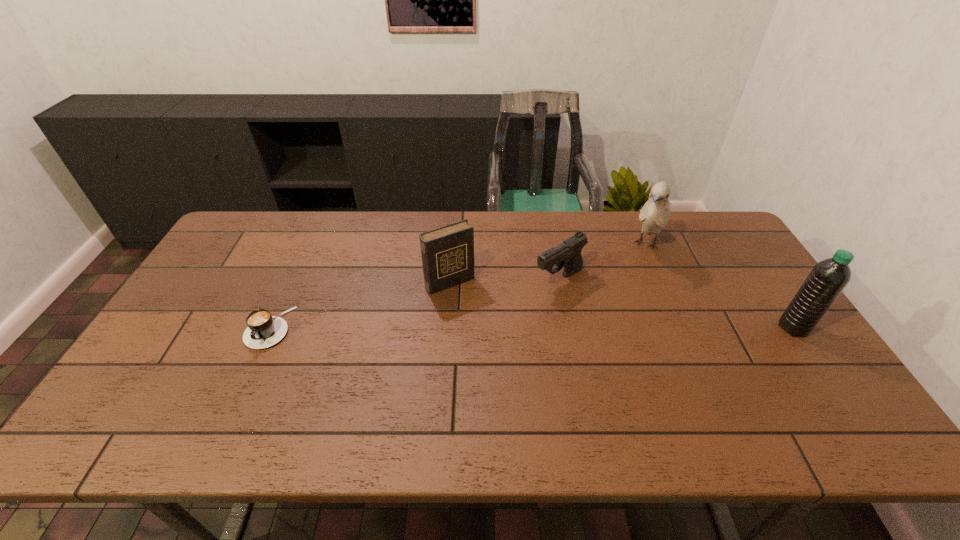
In the image, there is a desktop. Find the location of `vacant area at the far edge`. vacant area at the far edge is located at coordinates (446, 214).

This screenshot has width=960, height=540. Find the location of `free space at the near edge of the desktop`. free space at the near edge of the desktop is located at coordinates (396, 388).

The height and width of the screenshot is (540, 960). In the image, there is a desktop. Find the location of `vacant space at the left edge`. vacant space at the left edge is located at coordinates pyautogui.click(x=220, y=294).

Locate an element on the screen. This screenshot has height=540, width=960. vacant space at the right edge of the desktop is located at coordinates (711, 274).

In the image, there is a desktop. Identify the location of vacant space at the near left corner. This screenshot has height=540, width=960. (137, 399).

In the image, there is a desktop. Find the location of `vacant space at the near right corner`. vacant space at the near right corner is located at coordinates (821, 379).

Find the location of `unoccupied position between the fourth object from left to right and the water bottle`. unoccupied position between the fourth object from left to right and the water bottle is located at coordinates (720, 286).

Find the location of a particular element. This screenshot has height=540, width=960. unoccupied position between the shortest object and the diary is located at coordinates tap(360, 305).

At what (x,y) coordinates should I click in order to perform the action: click on free space between the fourth tallest object and the bird. Please return your answer as a coordinate pair (x, y). This screenshot has height=540, width=960. Looking at the image, I should click on (603, 262).

Locate an element on the screen. The width and height of the screenshot is (960, 540). vacant area that lies between the water bottle and the fourth tallest object is located at coordinates (676, 303).